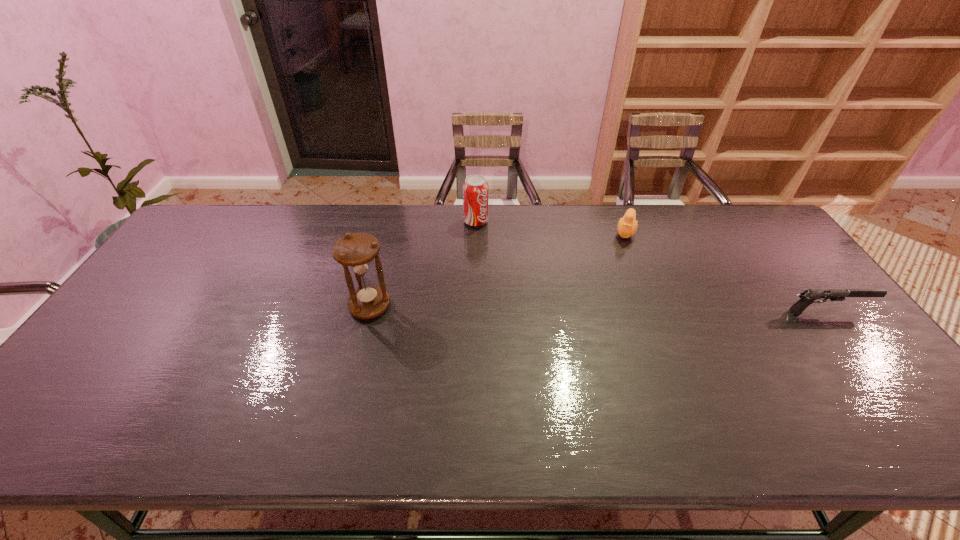
Locate an element on the screen. the leftmost object is located at coordinates (356, 251).

The image size is (960, 540). I want to click on hourglass, so click(x=356, y=251).

This screenshot has height=540, width=960. In order to click on gun in this screenshot , I will do `click(807, 297)`.

Locate an element on the screen. This screenshot has width=960, height=540. soda can is located at coordinates click(475, 188).

The width and height of the screenshot is (960, 540). Identify the location of the second object from left to right. (475, 188).

Where is `duckling`? The image size is (960, 540). duckling is located at coordinates (627, 226).

Locate an element on the screen. vacant space located 0.160m on the left of the hourglass is located at coordinates (293, 306).

Where is `blank space located 0.110m on the logo side of the soda can`? The image size is (960, 540). blank space located 0.110m on the logo side of the soda can is located at coordinates (503, 244).

Where is `free region located on the logo side of the soda can`? The width and height of the screenshot is (960, 540). free region located on the logo side of the soda can is located at coordinates (528, 265).

Identify the location of vacant position located on the logo side of the soda can. Image resolution: width=960 pixels, height=540 pixels. (550, 282).